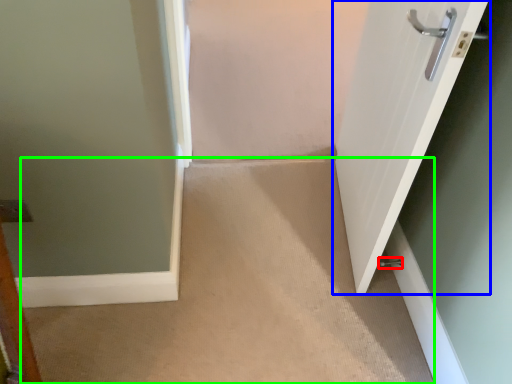
Question: Considering the real-world distances, which object is farthest from door handle (highlighted by a red box)? door (highlighted by a blue box) or corridor (highlighted by a green box)?

Choices:
 (A) door
 (B) corridor

Answer: (A)